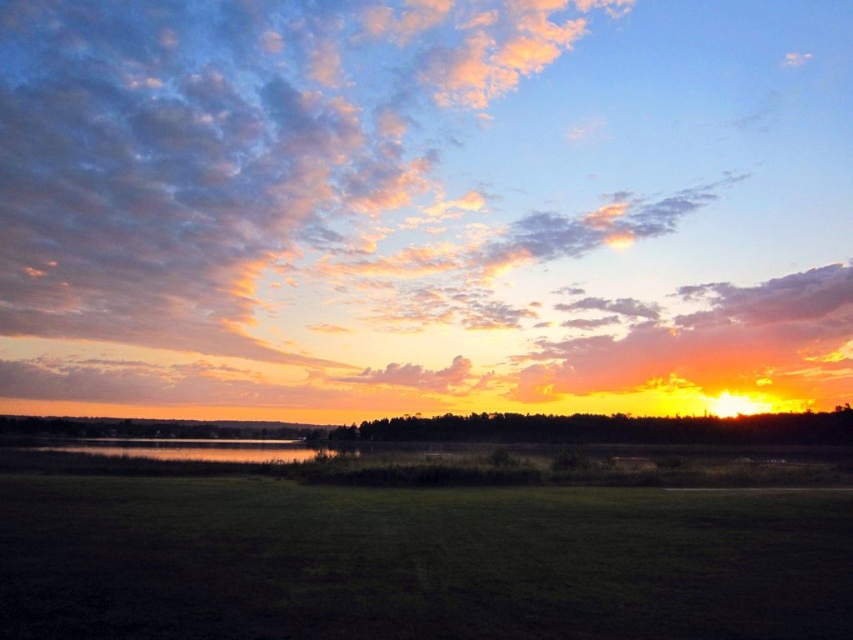
You are standing at the edge of the water in the sunset scene. You notice the cloudy sky at upper center and the green grass at lower center. Which of these two objects covers a wider area in the image?

The cloudy sky at upper center covers a wider area than the green grass at lower center because its width is larger.

Consider the image. You are standing in the grassy field in the foreground of the sunset scene. You see a point marked at coordinates (425,204). Based on the scene description, where is this point located?

The point at (425,204) is located on the cloudy sky at upper center.